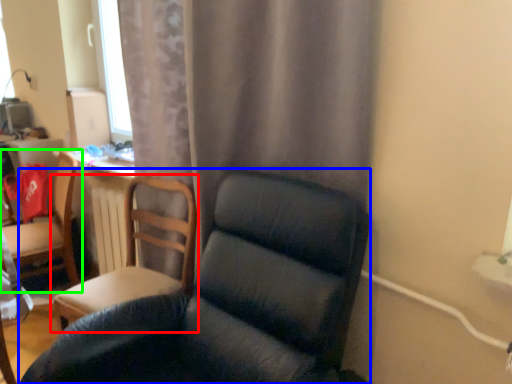
Question: Which object is the farthest from chair (highlighted by a red box)? Choose among these: chair (highlighted by a blue box) or chair (highlighted by a green box).

Choices:
 (A) chair
 (B) chair

Answer: (B)